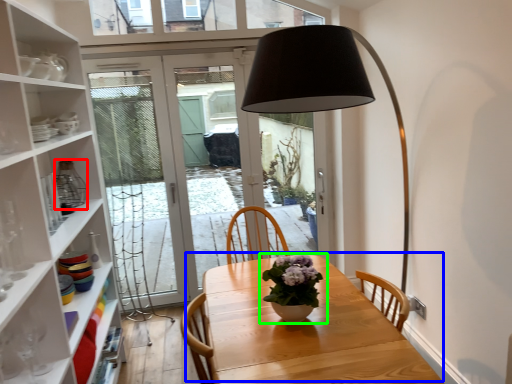
Question: Which is farther away from glass vase (highlighted by a red box)? table (highlighted by a blue box) or houseplant (highlighted by a green box)?

Choices:
 (A) table
 (B) houseplant

Answer: (B)